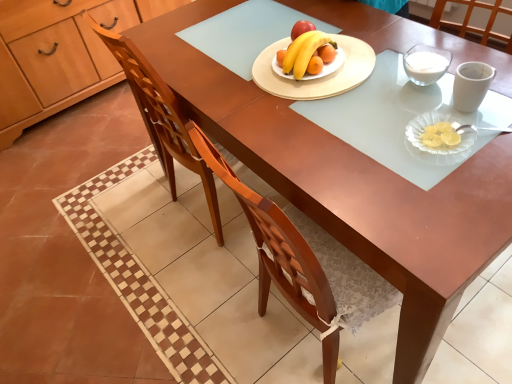
Where is `vacant area on top of wooden round platter at center, which ranks as the second platter in right-to-left order (from a real-world perspective)`? vacant area on top of wooden round platter at center, which ranks as the second platter in right-to-left order (from a real-world perspective) is located at coordinates (321, 63).